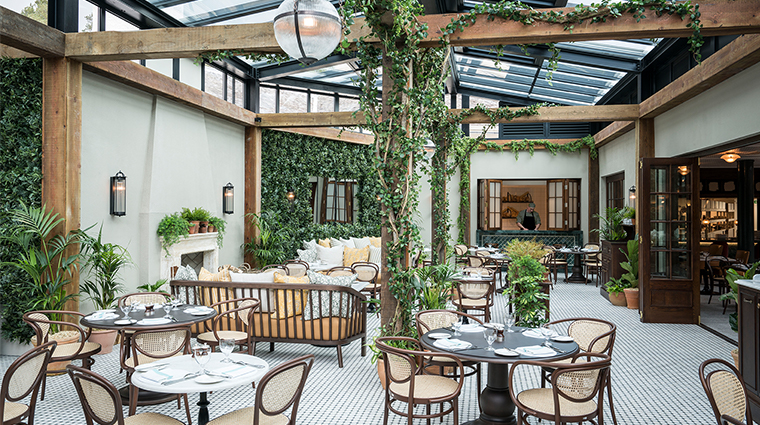
Where is `table`? The width and height of the screenshot is (760, 425). table is located at coordinates (195, 397).